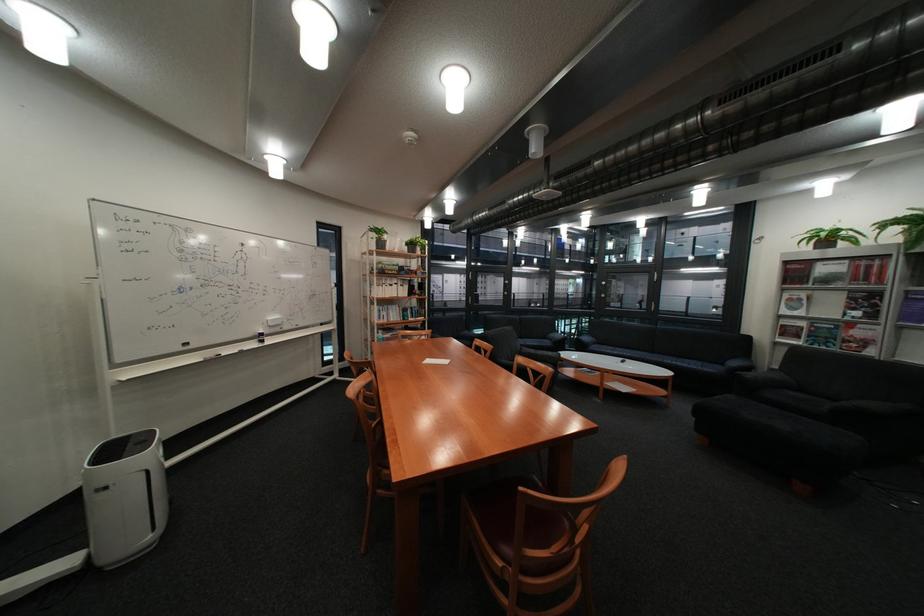
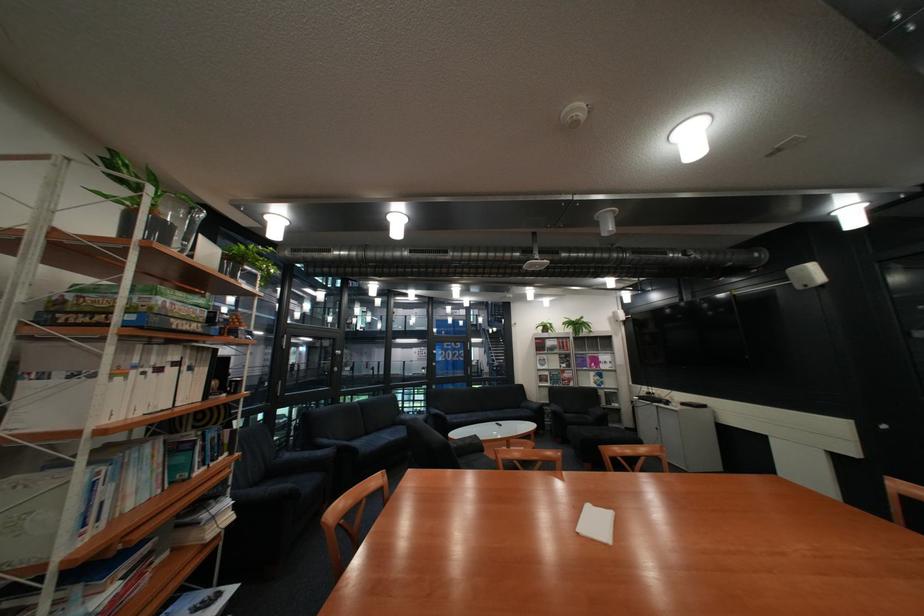
Locate, in the second image, the point that corresponds to the point at 637,353 in the first image.

(490, 418)